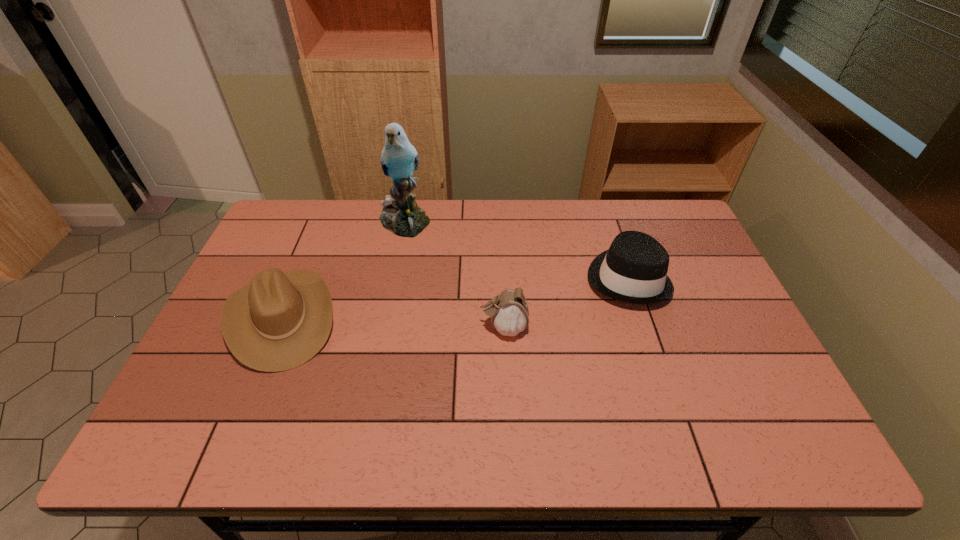
This screenshot has height=540, width=960. Identify the location of parakeet. (401, 215).

Find the location of `the second object from left to right`. the second object from left to right is located at coordinates (401, 215).

This screenshot has width=960, height=540. Find the location of `fedora`. fedora is located at coordinates (634, 269).

The height and width of the screenshot is (540, 960). Identify the location of the third object from left to right. (509, 312).

Locate an element on the screen. The image size is (960, 540). the leftmost object is located at coordinates (281, 320).

What are the coordinates of `free space located on the face of the third object from right to left` in the screenshot? It's located at (383, 332).

Locate an element on the screen. blank space located on the right of the fedora is located at coordinates (684, 278).

At what (x,y) coordinates should I click in order to perform the action: click on free point located 0.080m on the front-facing side of the second object from right to left. Please return your answer as a coordinate pair (x, y). The width and height of the screenshot is (960, 540). Looking at the image, I should click on (450, 328).

This screenshot has height=540, width=960. What are the coordinates of `blank area located 0.070m on the front-facing side of the second object from right to left` in the screenshot? It's located at (454, 328).

Identify the location of vacant space located on the front-facing side of the second object from right to left. (358, 328).